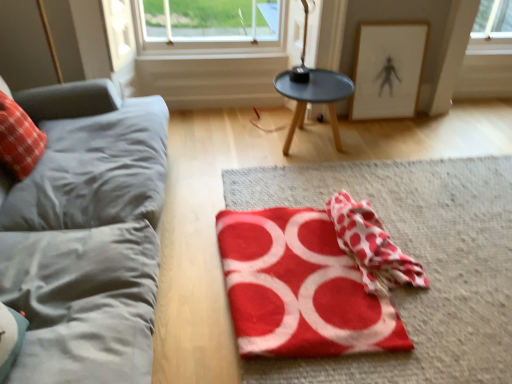
Question: Is red fabric at center at the right side of red felt yoga mat at center?

Choices:
 (A) no
 (B) yes

Answer: (B)

Question: Is red fabric at center positioned behind red felt yoga mat at center?

Choices:
 (A) no
 (B) yes

Answer: (A)

Question: Is red fabric at center at the left side of red felt yoga mat at center?

Choices:
 (A) no
 (B) yes

Answer: (A)

Question: Is the depth of red fabric at center less than that of red felt yoga mat at center?

Choices:
 (A) yes
 (B) no

Answer: (A)

Question: From the image's perspective, is red fabric at center below red felt yoga mat at center?

Choices:
 (A) yes
 (B) no

Answer: (B)

Question: From the image's perspective, relative to white paper picture frame at upper right, is red polka dot fabric at center above or below?

Choices:
 (A) above
 (B) below

Answer: (B)

Question: Do you think red polka dot fabric at center is within white paper picture frame at upper right, or outside of it?

Choices:
 (A) outside
 (B) inside

Answer: (A)

Question: Considering the relative positions of red polka dot fabric at center and white paper picture frame at upper right in the image provided, is red polka dot fabric at center to the left or to the right of white paper picture frame at upper right?

Choices:
 (A) left
 (B) right

Answer: (A)

Question: Considering the positions of point (379, 289) and point (428, 28), is point (379, 289) closer or farther from the camera than point (428, 28)?

Choices:
 (A) closer
 (B) farther

Answer: (A)

Question: Considering the relative positions of gray fabric couch at left and red felt yoga mat at center in the image provided, is gray fabric couch at left to the left or to the right of red felt yoga mat at center?

Choices:
 (A) left
 (B) right

Answer: (A)

Question: In the image, is gray fabric couch at left positioned in front of or behind red felt yoga mat at center?

Choices:
 (A) behind
 (B) front

Answer: (B)

Question: From a real-world perspective, is gray fabric couch at left above or below red felt yoga mat at center?

Choices:
 (A) below
 (B) above

Answer: (B)

Question: In terms of width, does gray fabric couch at left look wider or thinner when compared to red felt yoga mat at center?

Choices:
 (A) wide
 (B) thin

Answer: (A)

Question: Considering their positions, is red fabric at center located in front of or behind red polka dot fabric at center?

Choices:
 (A) behind
 (B) front

Answer: (B)

Question: From their relative heights in the image, would you say red fabric at center is taller or shorter than red polka dot fabric at center?

Choices:
 (A) tall
 (B) short

Answer: (B)